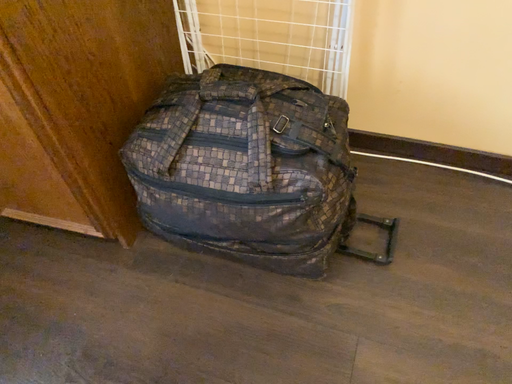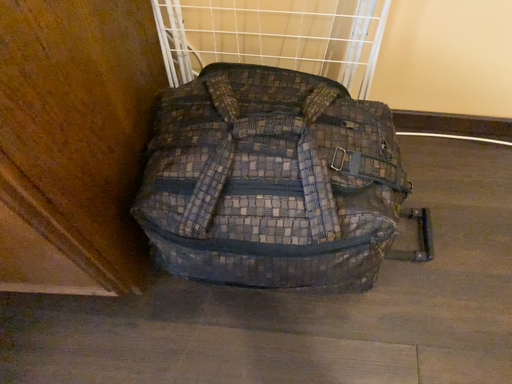
Question: Which way did the camera rotate in the video?

Choices:
 (A) rotated right
 (B) rotated left

Answer: (A)